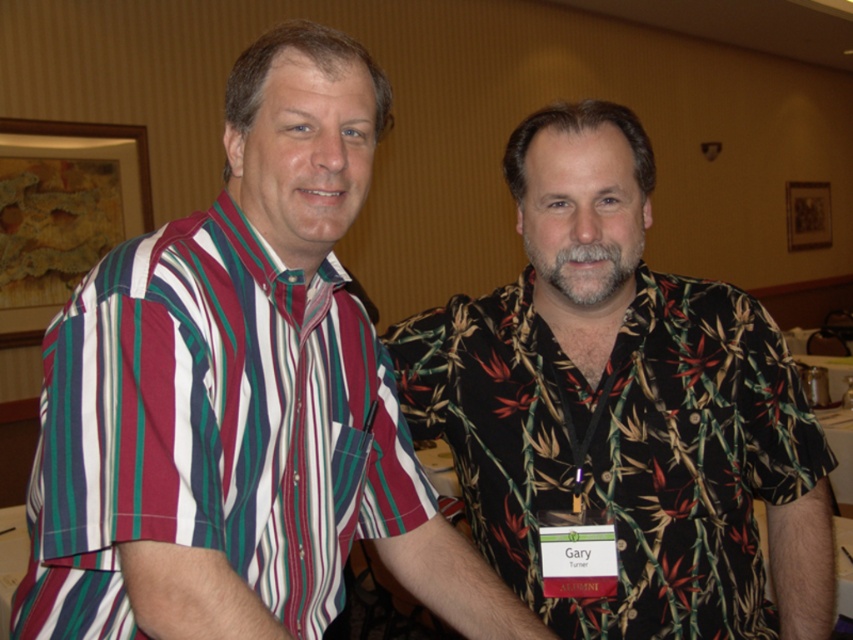
Question: Does black floral shirt at right have a greater width compared to striped cotton shirt at left?

Choices:
 (A) no
 (B) yes

Answer: (B)

Question: Observing the image, what is the correct spatial positioning of black floral shirt at right in reference to striped cotton shirt at left?

Choices:
 (A) left
 (B) right

Answer: (B)

Question: Which of the following is the farthest from the observer?

Choices:
 (A) striped cotton shirt at left
 (B) black floral shirt at right

Answer: (B)

Question: Is black floral shirt at right smaller than striped cotton shirt at left?

Choices:
 (A) yes
 (B) no

Answer: (B)

Question: Which of the following is the farthest from the observer?

Choices:
 (A) striped cotton shirt at left
 (B) black floral shirt at right

Answer: (B)